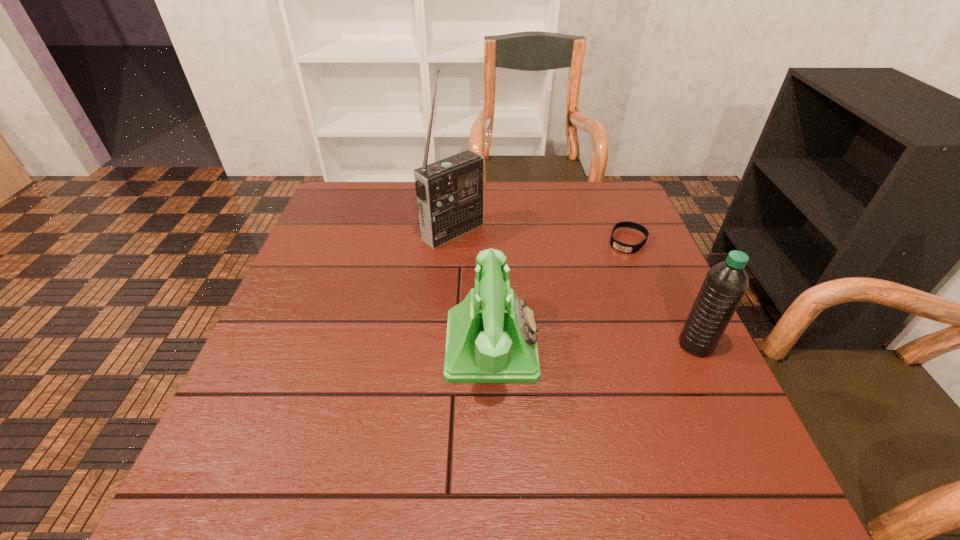
Where is `free space on the desktop that is between the third tallest object and the third shortest object and is positioned on the display of the tallest object`? The height and width of the screenshot is (540, 960). free space on the desktop that is between the third tallest object and the third shortest object and is positioned on the display of the tallest object is located at coordinates [x=603, y=345].

Identify the location of free space on the desktop that is between the telephone and the second tallest object and is positioned on the display of the wristband. (565, 345).